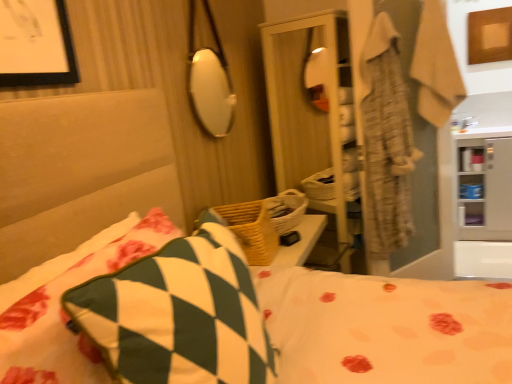
Question: From a real-world perspective, is white glossy cabinet at right on top of beige textured robe at upper right?

Choices:
 (A) yes
 (B) no

Answer: (B)

Question: Is white glossy cabinet at right to the left of beige textured robe at upper right from the viewer's perspective?

Choices:
 (A) yes
 (B) no

Answer: (B)

Question: Is white glossy cabinet at right to the right of beige textured robe at upper right from the viewer's perspective?

Choices:
 (A) no
 (B) yes

Answer: (B)

Question: Can you see white glossy cabinet at right touching beige textured robe at upper right?

Choices:
 (A) yes
 (B) no

Answer: (B)

Question: Is white glossy cabinet at right facing towards beige textured robe at upper right?

Choices:
 (A) yes
 (B) no

Answer: (B)

Question: Relative to woven wood basket at center, placed as the 1th basket when sorted from back to front, is woven wood basket at center, which ranks as the 2th basket in back-to-front order, in front or behind?

Choices:
 (A) behind
 (B) front

Answer: (B)

Question: From a real-world perspective, is woven wood basket at center, which is the 1th basket from front to back, positioned above or below woven wood basket at center, the second basket positioned from the front?

Choices:
 (A) above
 (B) below

Answer: (A)

Question: Is woven wood basket at center, which ranks as the 2th basket in back-to-front order, bigger or smaller than woven wood basket at center, the second basket positioned from the front?

Choices:
 (A) small
 (B) big

Answer: (B)

Question: Looking at their shapes, would you say woven wood basket at center, which is the 1th basket from front to back, is wider or thinner than woven wood basket at center, the second basket positioned from the front?

Choices:
 (A) thin
 (B) wide

Answer: (A)

Question: From the image's perspective, is woven wood basket at center, the second basket positioned from the front, positioned above or below woven wood basket at center, which ranks as the 2th basket in back-to-front order?

Choices:
 (A) below
 (B) above

Answer: (B)

Question: Considering the positions of woven wood basket at center, placed as the 1th basket when sorted from back to front, and woven wood basket at center, which is the 1th basket from front to back, in the image, is woven wood basket at center, placed as the 1th basket when sorted from back to front, wider or thinner than woven wood basket at center, which is the 1th basket from front to back,?

Choices:
 (A) wide
 (B) thin

Answer: (A)

Question: Is woven wood basket at center, the second basket positioned from the front, in front of or behind woven wood basket at center, which ranks as the 2th basket in back-to-front order, in the image?

Choices:
 (A) front
 (B) behind

Answer: (B)

Question: Looking at the image, does woven wood basket at center, the second basket positioned from the front, seem bigger or smaller compared to woven wood basket at center, which is the 1th basket from front to back?

Choices:
 (A) small
 (B) big

Answer: (A)

Question: Is point (484, 34) closer or farther from the camera than point (72, 299)?

Choices:
 (A) farther
 (B) closer

Answer: (A)

Question: Would you say wooden picture frame at upper right is to the left or to the right of green and white checkered pillow at center, the 1th pillow in the right-to-left sequence, in the picture?

Choices:
 (A) left
 (B) right

Answer: (B)